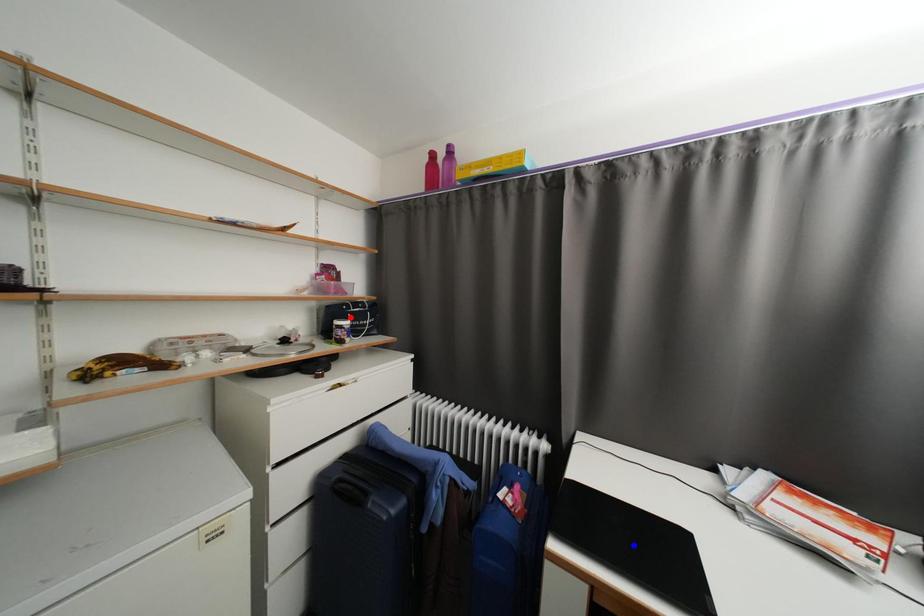
Question: In the image, two points are highlighted. Which point is nearer to the camera? Reply with the corresponding letter.

Choices:
 (A) blue point
 (B) red point

Answer: (A)